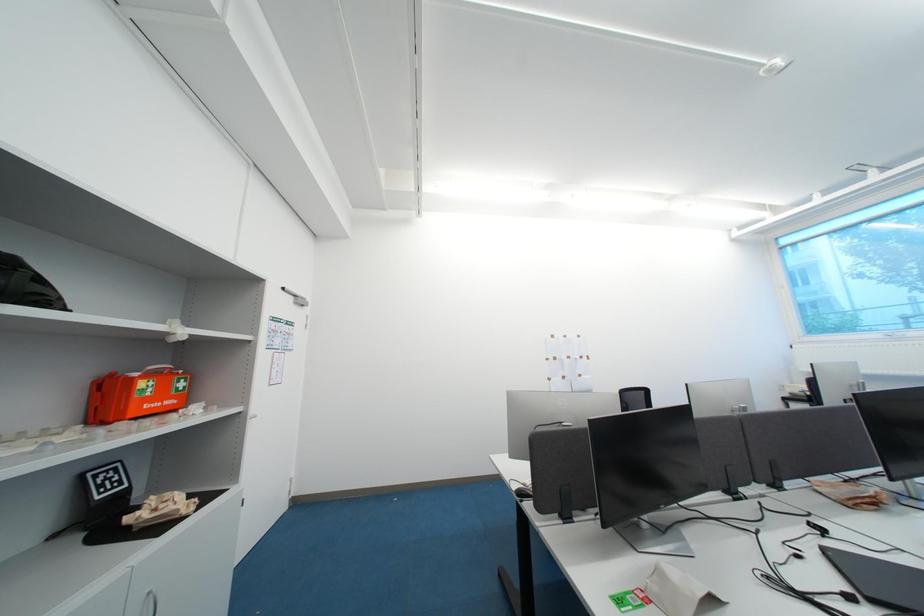
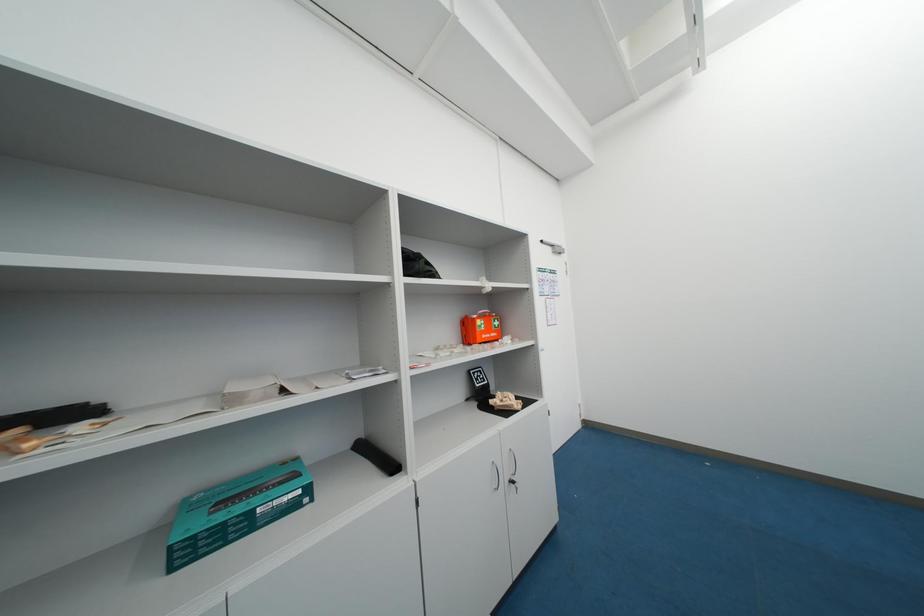
Question: Based on the continuous images, in which direction is the camera rotating? Reply with the corresponding letter.

Choices:
 (A) Left
 (B) Right
 (C) Up
 (D) Down

Answer: (A)